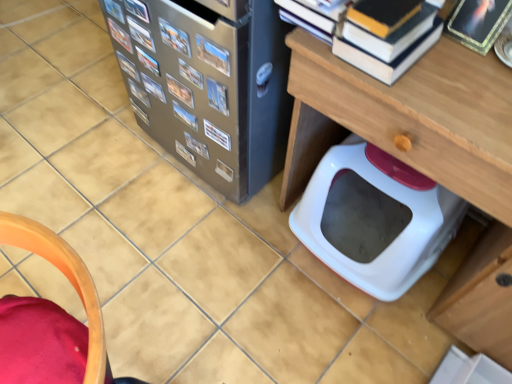
Question: Does metallic silver book at center-left, arranged as the 15th book when viewed from the front, appear on the left side of metallic photo album at upper center, which is the third book from front to back?

Choices:
 (A) no
 (B) yes

Answer: (B)

Question: Considering the relative sizes of metallic silver book at center-left, arranged as the first book when viewed from the back, and metallic photo album at upper center, marked as the 13th book in a back-to-front arrangement, in the image provided, is metallic silver book at center-left, arranged as the first book when viewed from the back, wider than metallic photo album at upper center, marked as the 13th book in a back-to-front arrangement,?

Choices:
 (A) yes
 (B) no

Answer: (B)

Question: Considering the relative positions of metallic silver book at center-left, arranged as the first book when viewed from the back, and metallic photo album at upper center, marked as the 13th book in a back-to-front arrangement, in the image provided, is metallic silver book at center-left, arranged as the first book when viewed from the back, to the right of metallic photo album at upper center, marked as the 13th book in a back-to-front arrangement, from the viewer's perspective?

Choices:
 (A) yes
 (B) no

Answer: (B)

Question: Is metallic silver book at center-left, arranged as the first book when viewed from the back, thinner than metallic photo album at upper center, which is the third book from front to back?

Choices:
 (A) yes
 (B) no

Answer: (A)

Question: Is metallic silver book at center-left, arranged as the 15th book when viewed from the front, far away from metallic photo album at upper center, marked as the 13th book in a back-to-front arrangement?

Choices:
 (A) yes
 (B) no

Answer: (B)

Question: Considering the positions of point (130, 4) and point (181, 31), is point (130, 4) closer or farther from the camera than point (181, 31)?

Choices:
 (A) farther
 (B) closer

Answer: (A)

Question: Considering their positions, is metallic silver book at upper left, placed as the twelfth book when sorted from back to front, located in front of or behind metallic photo album at upper center, which is the third book from front to back?

Choices:
 (A) front
 (B) behind

Answer: (B)

Question: Would you say metallic silver book at upper left, which is the fourth book from front to back, is to the left or to the right of metallic photo album at upper center, marked as the 13th book in a back-to-front arrangement, in the picture?

Choices:
 (A) left
 (B) right

Answer: (A)

Question: From the image's perspective, is metallic silver book at upper left, placed as the twelfth book when sorted from back to front, above or below metallic photo album at upper center, which is the third book from front to back?

Choices:
 (A) above
 (B) below

Answer: (A)

Question: From the image's perspective, is metallic photo album at upper center, which is the third book from front to back, located above or below metallic silver book at upper left, the eleventh book viewed from the front?

Choices:
 (A) above
 (B) below

Answer: (B)

Question: Is point (180, 38) closer or farther from the camera than point (114, 28)?

Choices:
 (A) farther
 (B) closer

Answer: (B)

Question: In the image, is metallic photo album at upper center, marked as the 13th book in a back-to-front arrangement, positioned in front of or behind metallic silver book at upper left, the eleventh book viewed from the front?

Choices:
 (A) front
 (B) behind

Answer: (A)

Question: Do you think metallic photo album at upper center, which is the third book from front to back, is within metallic silver book at upper left, which appears as the 5th book when viewed from the back, or outside of it?

Choices:
 (A) outside
 (B) inside

Answer: (A)

Question: Is hardcover book at upper right, the 1th book from the front, wider or thinner than metallic silver book at center, acting as the seventh book starting from the back?

Choices:
 (A) thin
 (B) wide

Answer: (B)

Question: From a real-world perspective, is hardcover book at upper right, the 15th book in the back-to-front sequence, physically located above or below metallic silver book at center, the 9th book viewed from the front?

Choices:
 (A) above
 (B) below

Answer: (A)